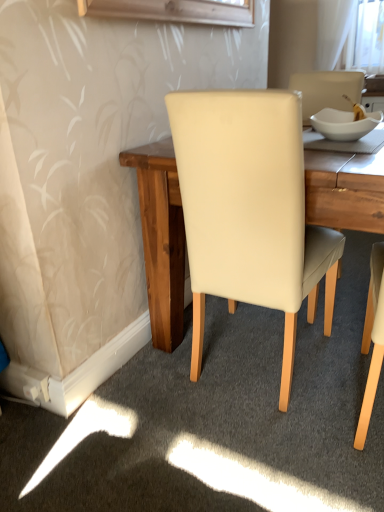
At what (x,y) coordinates should I click in order to perform the action: click on free spot above white glossy bowl at upper right (from a real-world perspective). Please return your answer as a coordinate pair (x, y). This screenshot has height=512, width=384. Looking at the image, I should click on (345, 115).